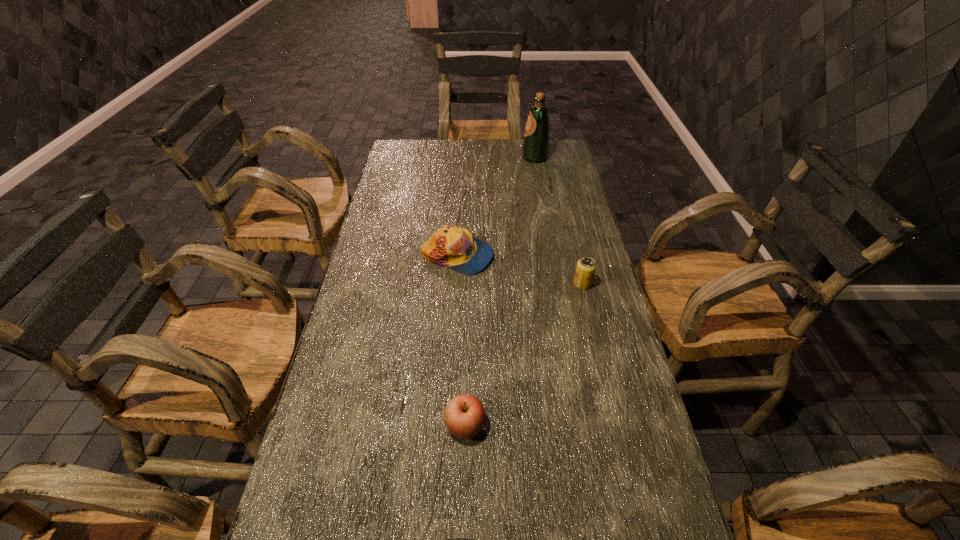
The image size is (960, 540). What are the coordinates of `vacant position in the image that satisfies the following two spatial constraints: 1. on the bill of the fourth nearest object; 2. on the left side of the third nearest object` in the screenshot? It's located at (456, 284).

The height and width of the screenshot is (540, 960). I want to click on blank space that satisfies the following two spatial constraints: 1. on the bill of the fourth nearest object; 2. on the right side of the second nearest object, so point(448,426).

Identify the location of vacant point that satisfies the following two spatial constraints: 1. on the bill of the apple; 2. on the left side of the cap. (448, 426).

This screenshot has height=540, width=960. I want to click on vacant region that satisfies the following two spatial constraints: 1. on the bill of the cap; 2. on the left side of the third nearest object, so click(456, 284).

Where is `free space that satisfies the following two spatial constraints: 1. on the back side of the fourth farthest object; 2. on the bill of the cap`? This screenshot has height=540, width=960. free space that satisfies the following two spatial constraints: 1. on the back side of the fourth farthest object; 2. on the bill of the cap is located at coordinates (469, 256).